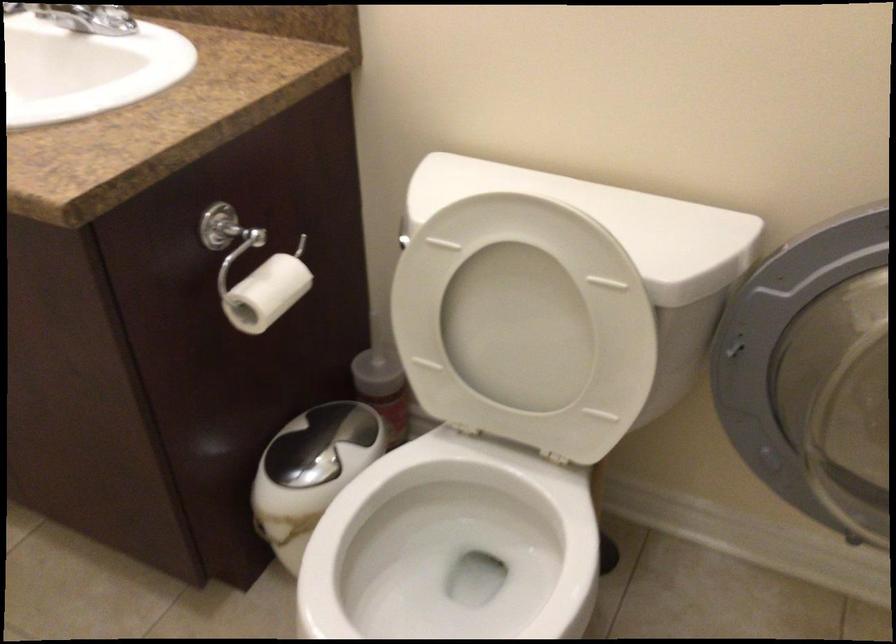
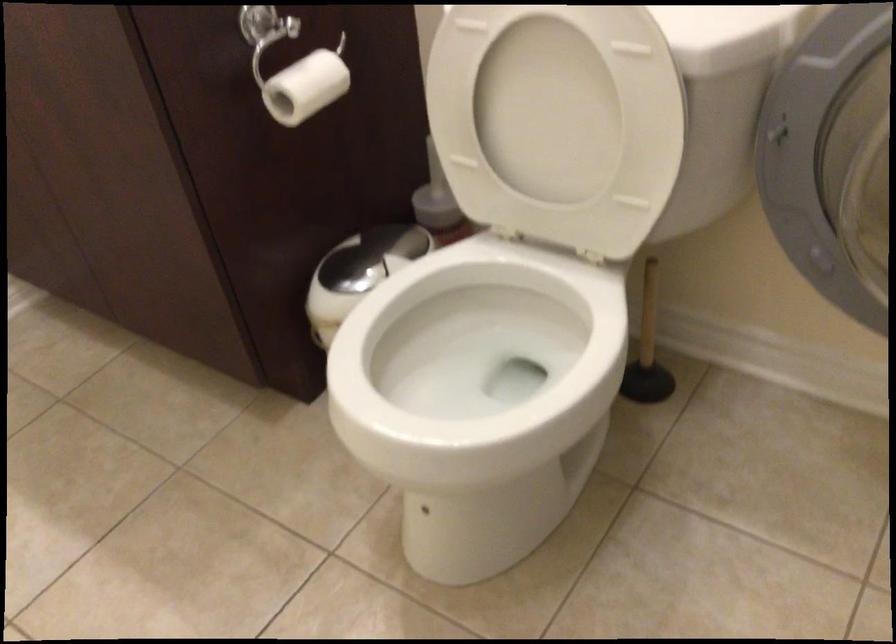
Question: Which direction would the cameraman need to move to produce the second image? Reply with the corresponding letter.

Choices:
 (A) Left
 (B) Right
 (C) Forward
 (D) Backward

Answer: (B)